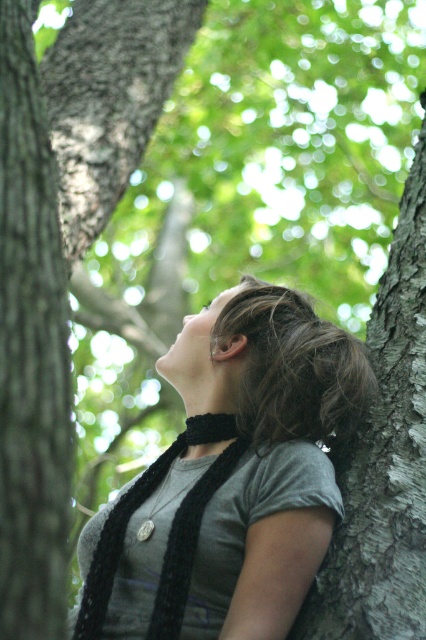
Question: Which of these objects is positioned closest to the black knitted strap at center?

Choices:
 (A) smooth brown bark at left
 (B) dark brown hair at center
 (C) dark gray bark at right
 (D) black knitted scarf at center

Answer: (D)

Question: Does black knitted scarf at center appear under smooth brown bark at left?

Choices:
 (A) yes
 (B) no

Answer: (A)

Question: Is black knitted scarf at center positioned in front of smooth brown bark at left?

Choices:
 (A) yes
 (B) no

Answer: (B)

Question: Which object appears closest to the camera in this image?

Choices:
 (A) black knitted strap at center
 (B) smooth brown bark at left
 (C) dark brown hair at center

Answer: (B)

Question: Which point is closer to the camera taking this photo?

Choices:
 (A) (147, 500)
 (B) (416, 541)
 (C) (34, 554)

Answer: (C)

Question: Is black knitted scarf at center positioned before black knitted strap at center?

Choices:
 (A) no
 (B) yes

Answer: (B)